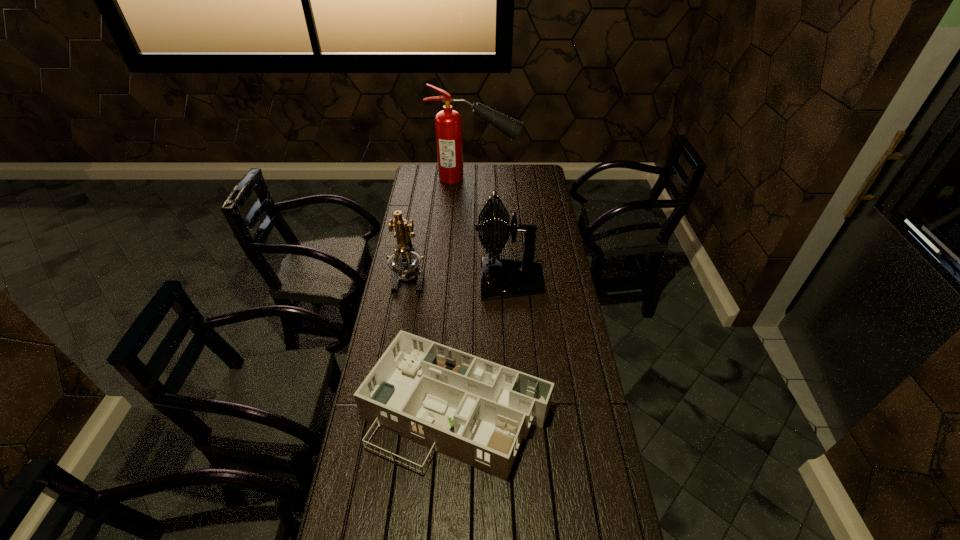
This screenshot has height=540, width=960. Identify the location of blank space located 0.360m at the eyepiece of the second shortest object. (394, 370).

The image size is (960, 540). Identify the location of free space located on the back of the shortest object. (462, 300).

I want to click on object that is at the far edge, so click(x=448, y=123).

At what (x,y) coordinates should I click in order to perform the action: click on fire extinguisher that is at the left edge. Please return your answer as a coordinate pair (x, y). Image resolution: width=960 pixels, height=540 pixels. Looking at the image, I should click on (448, 123).

Where is `microscope that is at the left edge`? Image resolution: width=960 pixels, height=540 pixels. microscope that is at the left edge is located at coordinates (404, 262).

In order to click on dollhouse located at the left edge in this screenshot , I will do `click(476, 411)`.

Identify the location of fire extinguisher that is at the right edge. (448, 123).

You are a GUI agent. You are given a task and a screenshot of the screen. Output one action in this format:
    pyautogui.click(x=<x>, y=<y>)
    Task: Click on the fan at the right edge
    The height and width of the screenshot is (540, 960).
    Given the screenshot: What is the action you would take?
    pyautogui.click(x=500, y=278)

Image resolution: width=960 pixels, height=540 pixels. What are the coordinates of `dollhouse situated at the right edge` in the screenshot? It's located at (476, 411).

Identify the location of object at the far left corner. The height and width of the screenshot is (540, 960). (448, 123).